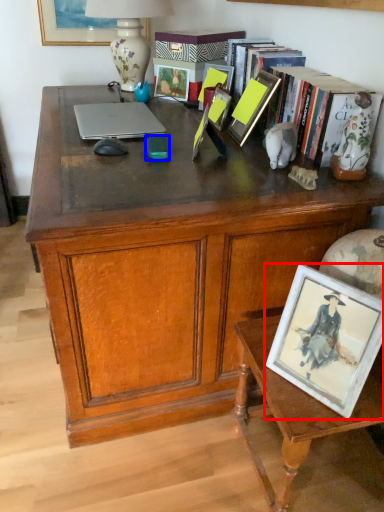
Question: Among these objects, which one is nearest to the camera, picture frame (highlighted by a red box) or mobile phone (highlighted by a blue box)?

Choices:
 (A) picture frame
 (B) mobile phone

Answer: (A)